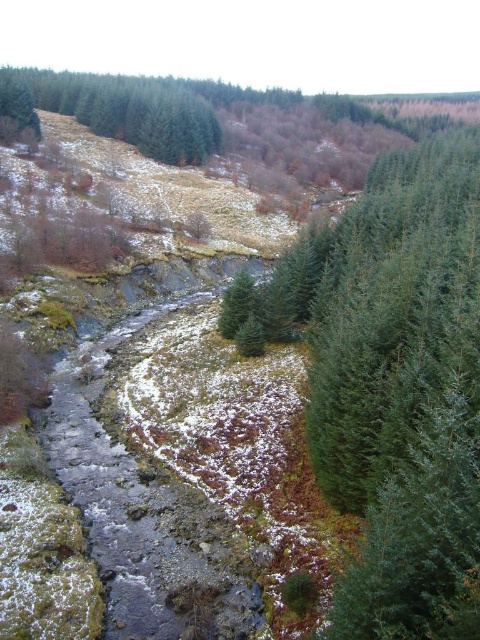
Question: Among these points, which one is nearest to the camera?

Choices:
 (A) (23, 81)
 (B) (386, 422)

Answer: (B)

Question: Can you confirm if green needle-like tree at center-right is positioned below green matte tree at upper left?

Choices:
 (A) no
 (B) yes

Answer: (B)

Question: Which point is closer to the camera?

Choices:
 (A) green matte tree at upper left
 (B) green needle-like tree at center-right

Answer: (B)

Question: Observing the image, what is the correct spatial positioning of green needle-like tree at center-right in reference to green matte tree at upper left?

Choices:
 (A) right
 (B) left

Answer: (A)

Question: In this image, where is green needle-like tree at center-right located relative to green matte tree at upper left?

Choices:
 (A) left
 (B) right

Answer: (B)

Question: Which point is closer to the camera?

Choices:
 (A) green matte tree at upper left
 (B) green needle-like tree at center-right

Answer: (B)